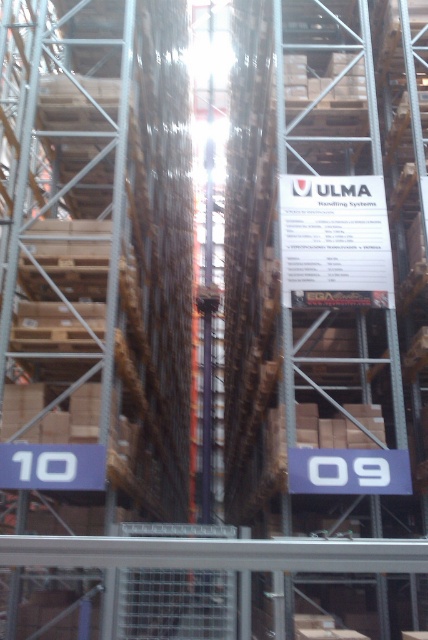
You are a warehouse worker who needs to locate two specific signs in the warehouse. You see the white paper sign at center and the white plastic sign at lower center. Which one is positioned to the right side of the other?

The white paper sign at center is to the right of the white plastic sign at lower center.

You are a warehouse worker who needs to place a new box on the shelf. The box requires a space that is at least 1.5 meters tall. You see the white paper sign at center and the white plastic sign at lower center. Which sign indicates a shelf that can accommodate the box?

The white paper sign at center is much taller than the white plastic sign at lower center, so the shelf indicated by the white paper sign at center can accommodate the box since it meets the height requirement of 1.5 meters.